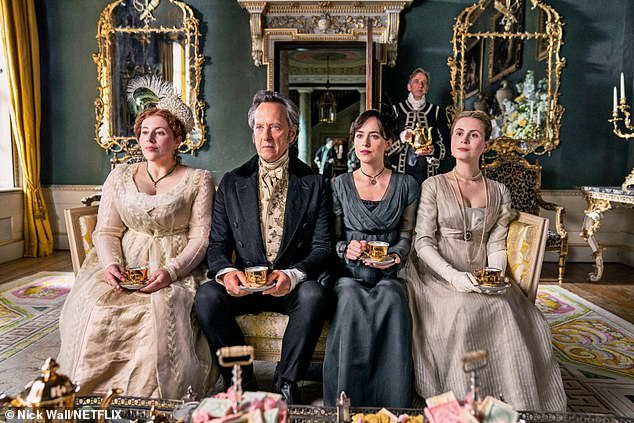
Find the location of a particular element. mirror is located at coordinates (136, 51), (529, 68).